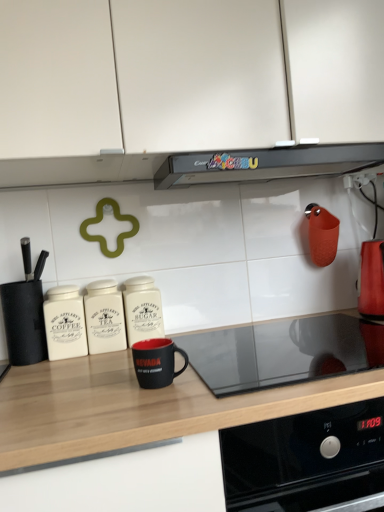
Question: Considering the positions of white ceramic coffee canister at left, which ranks as the second kitchen appliance in left-to-right order, and white ceramic canister at center, which is counted as the fourth kitchen appliance, starting from the right, in the image, is white ceramic coffee canister at left, which ranks as the second kitchen appliance in left-to-right order, taller or shorter than white ceramic canister at center, which is counted as the fourth kitchen appliance, starting from the right,?

Choices:
 (A) short
 (B) tall

Answer: (A)

Question: From a real-world perspective, is white ceramic coffee canister at left, which ranks as the 5th kitchen appliance in right-to-left order, above or below white ceramic canister at center, the third kitchen appliance viewed from the left?

Choices:
 (A) above
 (B) below

Answer: (B)

Question: Which object is the closest to the white matte cabinet at upper center?

Choices:
 (A) white ceramic coffee canister at left, which ranks as the second kitchen appliance in left-to-right order
 (B) black matte mug at center, placed as the 4th kitchen appliance when sorted from left to right
 (C) black plastic range hood at upper center, which ranks as the 2th kitchen appliance in right-to-left order
 (D) white ceramic canister at center, the third kitchen appliance viewed from the left
 (E) black glass cooktop at center

Answer: (C)

Question: Which object is the farthest from the black matte countertop at center?

Choices:
 (A) black plastic range hood at upper center, which ranks as the 2th kitchen appliance in right-to-left order
 (B) black glass cooktop at center
 (C) white ceramic canister at center, which is counted as the fourth kitchen appliance, starting from the right
 (D) black matte knife block at left, which appears as the 6th kitchen appliance when viewed from the right
 (E) white ceramic coffee canister at left, which ranks as the second kitchen appliance in left-to-right order

Answer: (A)